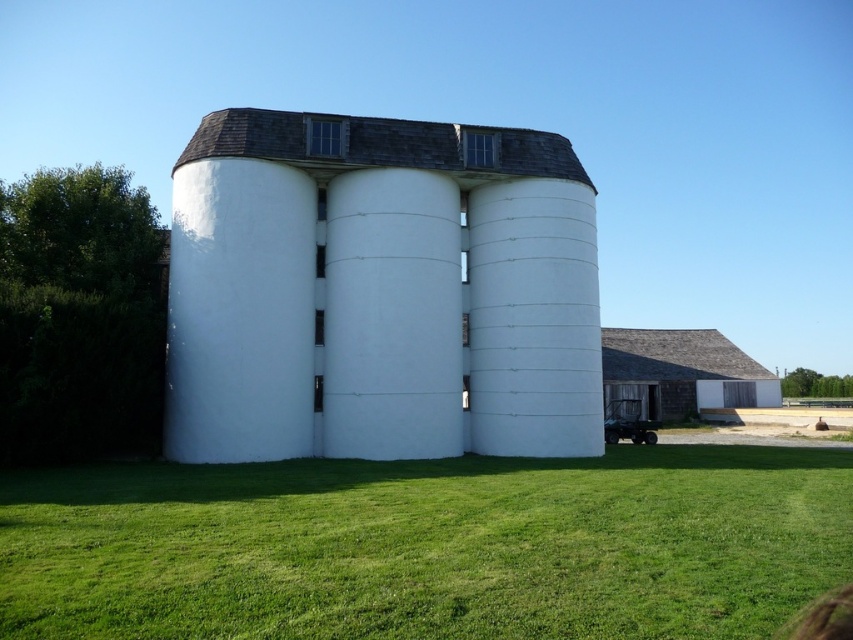
Question: Which point is farther to the camera?

Choices:
 (A) (352, 212)
 (B) (791, 580)

Answer: (A)

Question: Does green grass at center appear over white smooth silo at center?

Choices:
 (A) yes
 (B) no

Answer: (B)

Question: Can you confirm if green grass at center is positioned to the left of white smooth silo at center?

Choices:
 (A) yes
 (B) no

Answer: (B)

Question: Is green grass at center closer to camera compared to white smooth silo at center?

Choices:
 (A) yes
 (B) no

Answer: (A)

Question: Which point is farther to the camera?

Choices:
 (A) green grass at center
 (B) white smooth silo at center

Answer: (B)